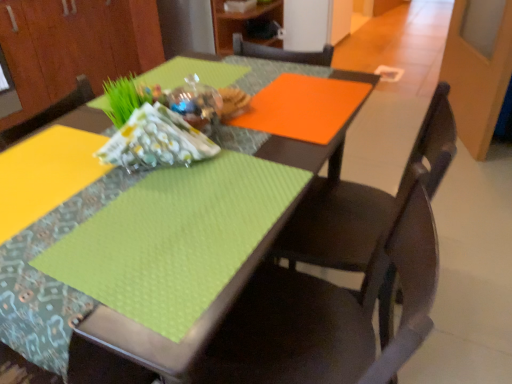
Question: Is matte wood cabinet at upper left, the second cabinetry positioned from the right, far away from matte wood cabinet at upper center, which appears as the 2th cabinetry when viewed from the left?

Choices:
 (A) yes
 (B) no

Answer: (B)

Question: Can you confirm if matte wood cabinet at upper left, the second cabinetry positioned from the right, is bigger than matte wood cabinet at upper center, which appears as the first cabinetry when viewed from the right?

Choices:
 (A) yes
 (B) no

Answer: (A)

Question: Can you see matte wood cabinet at upper left, which is the 1th cabinetry from left to right, touching matte wood cabinet at upper center, which appears as the first cabinetry when viewed from the right?

Choices:
 (A) no
 (B) yes

Answer: (A)

Question: Considering the relative sizes of matte wood cabinet at upper left, the second cabinetry positioned from the right, and matte wood cabinet at upper center, which appears as the 2th cabinetry when viewed from the left, in the image provided, is matte wood cabinet at upper left, the second cabinetry positioned from the right, taller than matte wood cabinet at upper center, which appears as the 2th cabinetry when viewed from the left,?

Choices:
 (A) no
 (B) yes

Answer: (B)

Question: Can you confirm if matte wood cabinet at upper left, the second cabinetry positioned from the right, is positioned to the left of matte wood cabinet at upper center, which appears as the 2th cabinetry when viewed from the left?

Choices:
 (A) no
 (B) yes

Answer: (B)

Question: Is matte black chair at center, the first chair from the back, wider or thinner than matte wood cabinet at upper center, which appears as the first cabinetry when viewed from the right?

Choices:
 (A) wide
 (B) thin

Answer: (B)

Question: Would you say matte black chair at center, the first chair from the back, is inside or outside matte wood cabinet at upper center, which appears as the 2th cabinetry when viewed from the left?

Choices:
 (A) inside
 (B) outside

Answer: (B)

Question: Based on their positions, is matte black chair at center, which is the second chair from front to back, located to the left or right of matte wood cabinet at upper center, which appears as the first cabinetry when viewed from the right?

Choices:
 (A) right
 (B) left

Answer: (A)

Question: From the image's perspective, relative to matte wood cabinet at upper center, which appears as the 2th cabinetry when viewed from the left, is matte black chair at center, the first chair from the back, above or below?

Choices:
 (A) below
 (B) above

Answer: (A)

Question: From the image's perspective, is patterned fabric at center above or below matte black chair at center, which is the second chair from front to back?

Choices:
 (A) above
 (B) below

Answer: (A)

Question: Considering the positions of patterned fabric at center and matte black chair at center, the first chair from the back, in the image, is patterned fabric at center taller or shorter than matte black chair at center, the first chair from the back,?

Choices:
 (A) tall
 (B) short

Answer: (B)

Question: Is patterned fabric at center bigger or smaller than matte black chair at center, which is the second chair from front to back?

Choices:
 (A) big
 (B) small

Answer: (B)

Question: Visually, is patterned fabric at center positioned to the left or to the right of matte black chair at center, which is the second chair from front to back?

Choices:
 (A) left
 (B) right

Answer: (A)

Question: Is point (187, 160) closer or farther from the camera than point (66, 82)?

Choices:
 (A) farther
 (B) closer

Answer: (B)

Question: From their relative heights in the image, would you say patterned fabric at center is taller or shorter than matte wood cabinet at upper left, the second cabinetry positioned from the right?

Choices:
 (A) tall
 (B) short

Answer: (B)